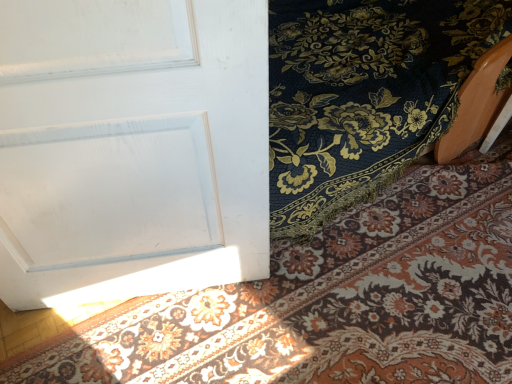
This screenshot has height=384, width=512. What do you see at coordinates (331, 301) in the screenshot?
I see `floral carpet at lower right` at bounding box center [331, 301].

The height and width of the screenshot is (384, 512). What are the coordinates of `floral carpet at lower right` in the screenshot? It's located at (331, 301).

Where is `floral carpet at lower right`? Image resolution: width=512 pixels, height=384 pixels. floral carpet at lower right is located at coordinates (331, 301).